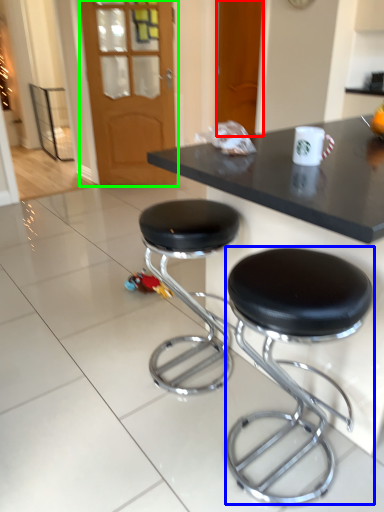
Question: Estimate the real-world distances between objects in this image. Which object is farther from door (highlighted by a red box), stool (highlighted by a blue box) or glass door (highlighted by a green box)?

Choices:
 (A) stool
 (B) glass door

Answer: (A)